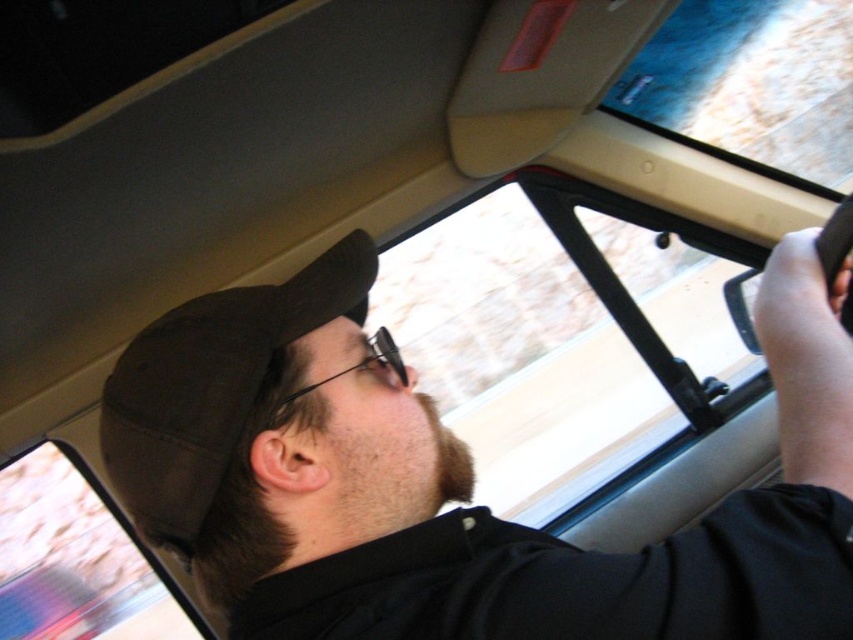
Question: Does black matte cap at upper left appear over black fabric baseball hat at upper left?

Choices:
 (A) no
 (B) yes

Answer: (A)

Question: Is black matte cap at upper left thinner than black fabric baseball hat at upper left?

Choices:
 (A) yes
 (B) no

Answer: (B)

Question: Which of the following is the farthest from the observer?

Choices:
 (A) (412, 621)
 (B) (166, 440)

Answer: (B)

Question: Is black matte cap at upper left behind black fabric baseball hat at upper left?

Choices:
 (A) yes
 (B) no

Answer: (B)